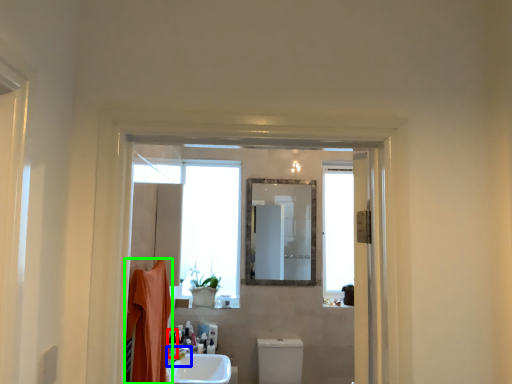
Question: Which object is the closest to the toiletry (highlighted by a red box)? Choose among these: tap (highlighted by a blue box) or bath towel (highlighted by a green box).

Choices:
 (A) tap
 (B) bath towel

Answer: (A)